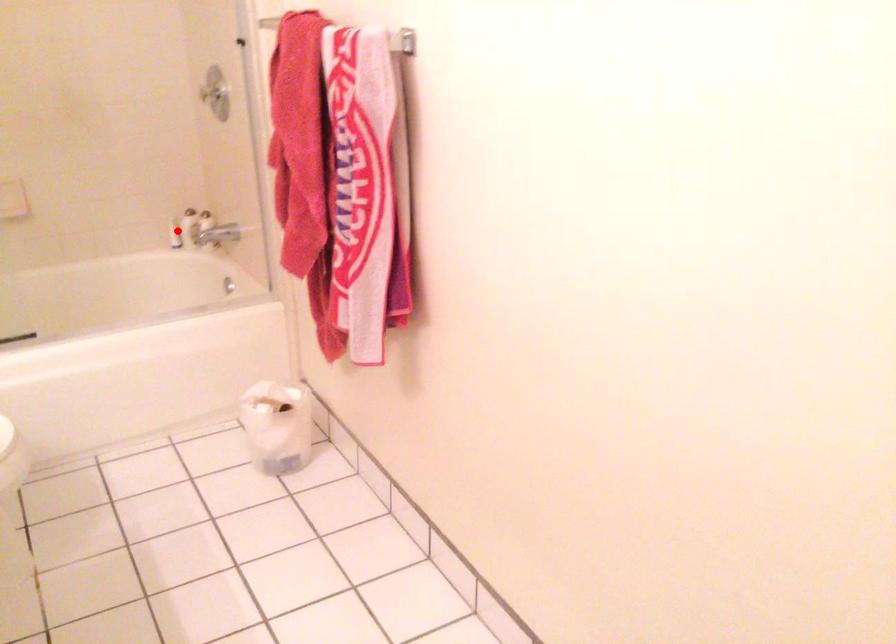
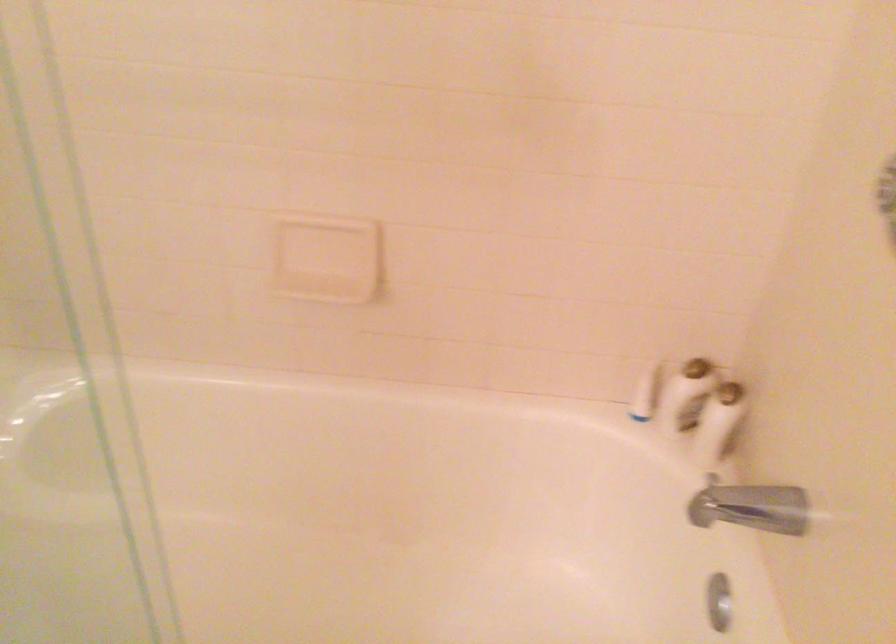
Where in the second image is the point corresponding to the highlighted location from the first image?

(644, 393)